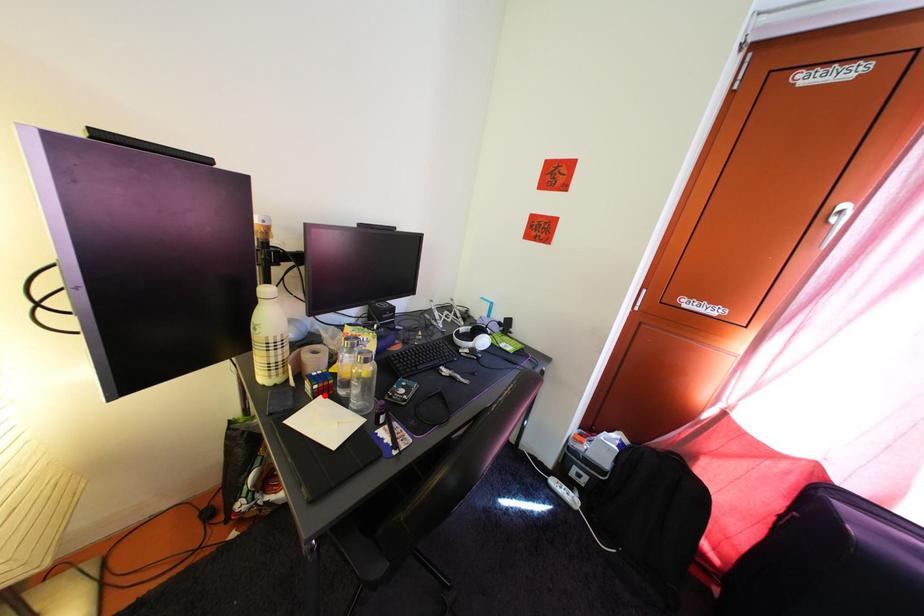
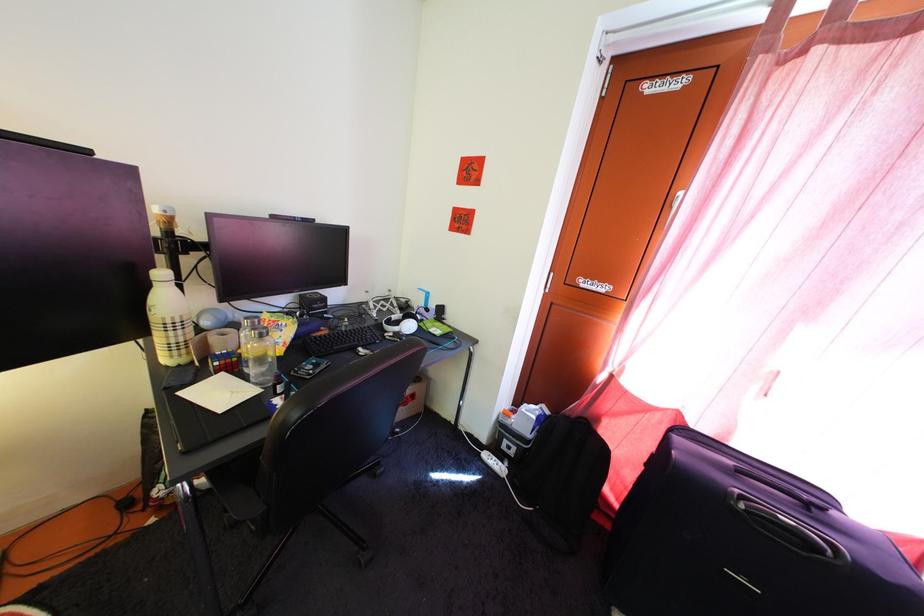
In the second image, find the point that corresponds to the highlighted location in the first image.

(225, 371)